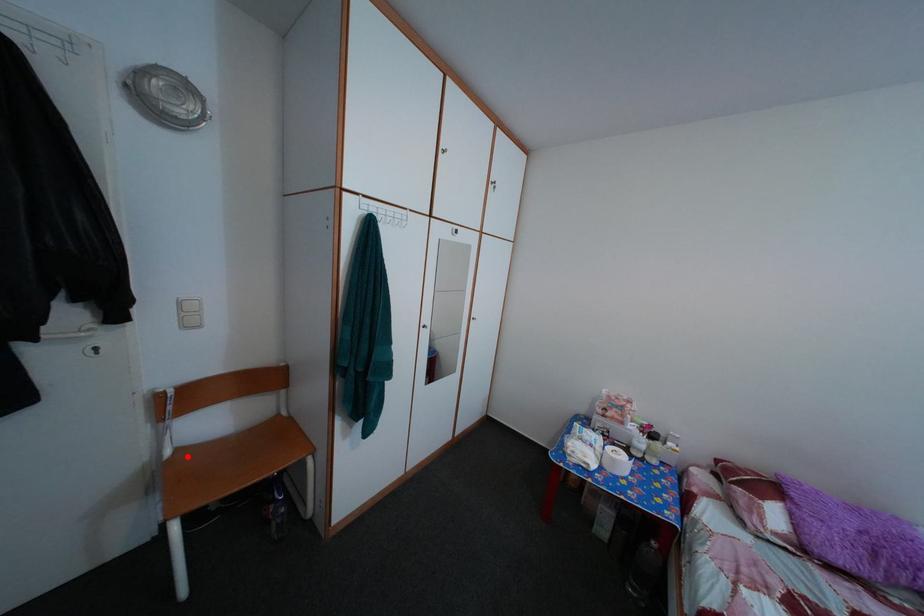
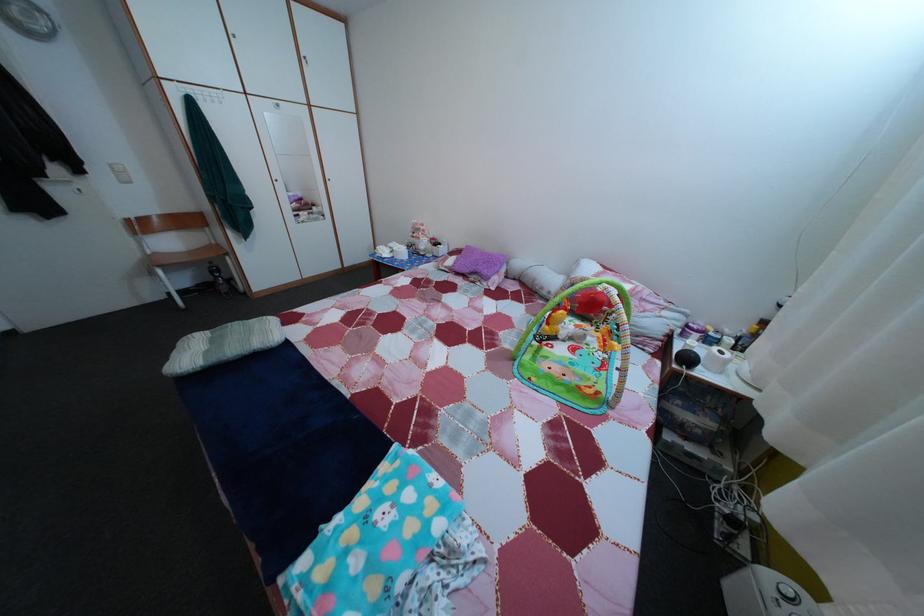
The point at the highlighted location is marked in the first image. Where is the corresponding point in the second image?

(164, 261)